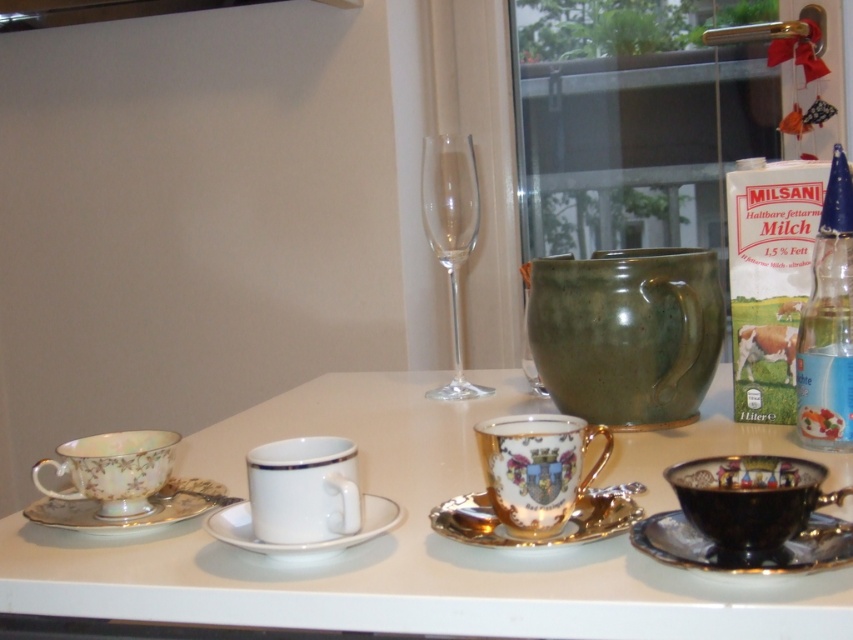
Can you confirm if green matte teacup at center is bigger than gold metallic saucer at center?

Yes, green matte teacup at center is bigger than gold metallic saucer at center.

Describe the element at coordinates (625, 333) in the screenshot. The width and height of the screenshot is (853, 640). I see `green matte teacup at center` at that location.

Where is `green matte teacup at center`? The height and width of the screenshot is (640, 853). green matte teacup at center is located at coordinates (625, 333).

Is white porcelain cups at center positioned before transparent glass wine glass at center?

Yes, white porcelain cups at center is in front of transparent glass wine glass at center.

Which is behind, point (114, 602) or point (424, 228)?

Point (424, 228)

Who is more distant from viewer, (506, 561) or (477, 212)?

Point (477, 212)

Find the location of a particular element. The height and width of the screenshot is (640, 853). white porcelain cups at center is located at coordinates pos(395,545).

What do you see at coordinates (114, 468) in the screenshot?
I see `porcelain floral teacup at left` at bounding box center [114, 468].

Who is more forward, (97,468) or (28,515)?

Point (97,468)

This screenshot has height=640, width=853. Describe the element at coordinates (114, 468) in the screenshot. I see `porcelain floral teacup at left` at that location.

Where is `porcelain floral teacup at left`? This screenshot has height=640, width=853. porcelain floral teacup at left is located at coordinates (114, 468).